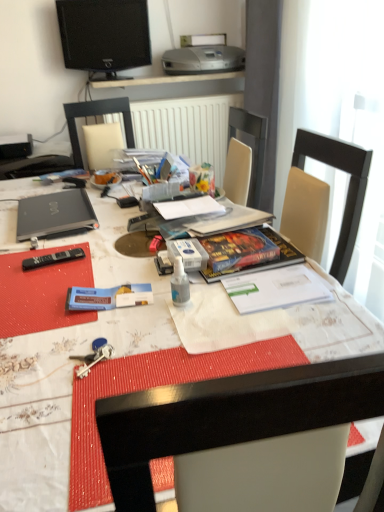
Find the location of `free space between transparent plastic spray bottle at center and black plastic remote control at lower left`. free space between transparent plastic spray bottle at center and black plastic remote control at lower left is located at coordinates (99, 275).